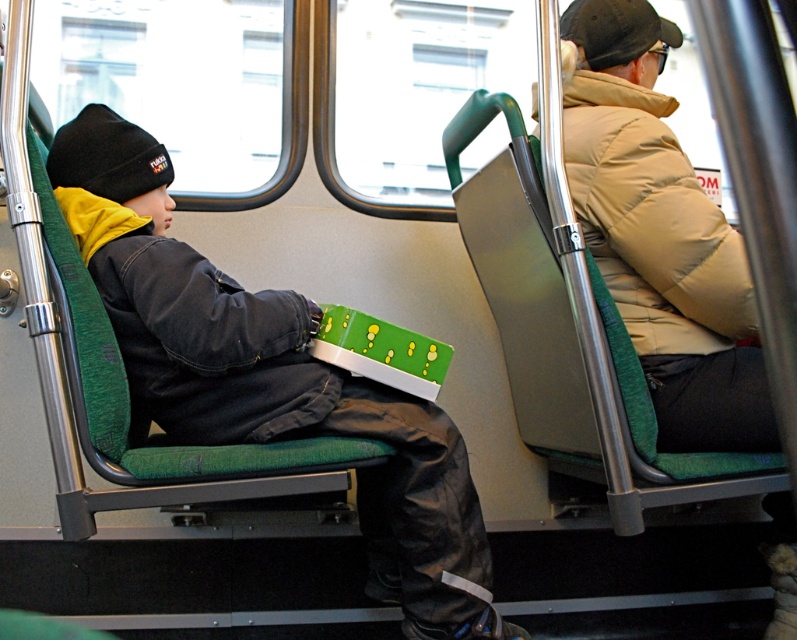
Question: Can you confirm if beige puffy jacket at upper right is positioned to the left of black fleece beanie at left?

Choices:
 (A) yes
 (B) no

Answer: (B)

Question: Considering the relative positions of beige puffy jacket at upper right and black knit cap at upper right in the image provided, where is beige puffy jacket at upper right located with respect to black knit cap at upper right?

Choices:
 (A) left
 (B) right

Answer: (A)

Question: Among these points, which one is farthest from the camera?

Choices:
 (A) (391, 541)
 (B) (597, 67)

Answer: (B)

Question: Which point is closer to the camera?

Choices:
 (A) black fleece beanie at left
 (B) black knit cap at upper right
 (C) beige puffy jacket at upper right

Answer: (C)

Question: Is beige puffy jacket at upper right smaller than black knit cap at upper right?

Choices:
 (A) no
 (B) yes

Answer: (A)

Question: Estimate the real-world distances between objects in this image. Which object is farther from the black fleece beanie at left?

Choices:
 (A) black knit cap at upper right
 (B) beige puffy jacket at upper right

Answer: (A)